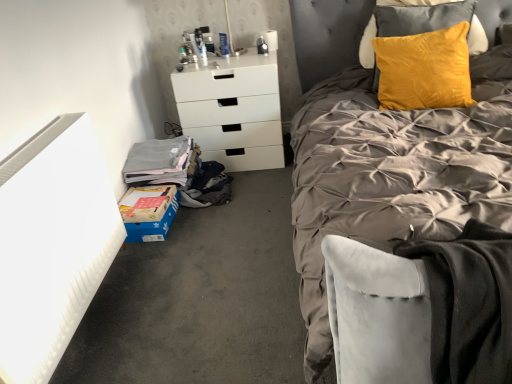
Identify the location of free point to the right of blue cardboard box at lower left. The width and height of the screenshot is (512, 384). (198, 223).